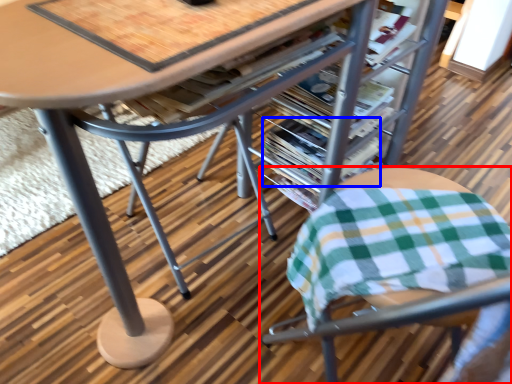
Question: Which of the following is the farthest to the observer, chair (highlighted by a red box) or magazine (highlighted by a blue box)?

Choices:
 (A) chair
 (B) magazine

Answer: (B)